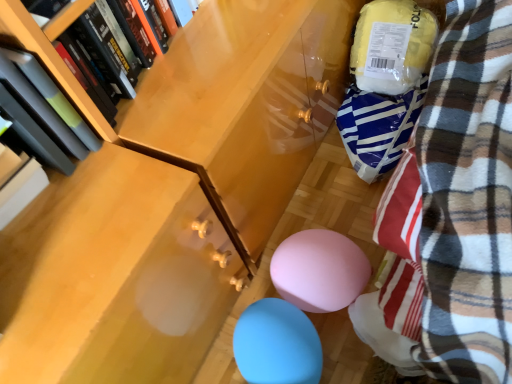
Question: From a real-world perspective, is blue rubber balloon at lower center on top of hardcover book at upper left, which appears as the 2th book when viewed from the left?

Choices:
 (A) no
 (B) yes

Answer: (A)

Question: Is hardcover book at upper left, the first book when ordered from right to left, inside blue rubber balloon at lower center?

Choices:
 (A) no
 (B) yes

Answer: (A)

Question: From the image's perspective, does blue rubber balloon at lower center appear lower than hardcover book at upper left, which appears as the 2th book when viewed from the left?

Choices:
 (A) yes
 (B) no

Answer: (A)

Question: Is blue rubber balloon at lower center to the right of hardcover book at upper left, which appears as the 2th book when viewed from the left, from the viewer's perspective?

Choices:
 (A) no
 (B) yes

Answer: (B)

Question: Is blue rubber balloon at lower center facing away from hardcover book at upper left, the first book when ordered from right to left?

Choices:
 (A) yes
 (B) no

Answer: (B)

Question: Is the depth of blue rubber balloon at lower center greater than that of hardcover book at upper left, the first book when ordered from right to left?

Choices:
 (A) yes
 (B) no

Answer: (A)

Question: Is matte black book at left, arranged as the first book when viewed from the left, bigger than hardcover book at upper left, the first book when ordered from right to left?

Choices:
 (A) yes
 (B) no

Answer: (A)

Question: From a real-world perspective, is matte black book at left, the 2th book viewed from the right, under hardcover book at upper left, the first book when ordered from right to left?

Choices:
 (A) no
 (B) yes

Answer: (A)

Question: Is matte black book at left, arranged as the first book when viewed from the left, directly adjacent to hardcover book at upper left, the first book when ordered from right to left?

Choices:
 (A) no
 (B) yes

Answer: (A)

Question: Is matte black book at left, the 2th book viewed from the right, positioned before hardcover book at upper left, which appears as the 2th book when viewed from the left?

Choices:
 (A) no
 (B) yes

Answer: (B)

Question: From the image's perspective, would you say matte black book at left, arranged as the first book when viewed from the left, is positioned over hardcover book at upper left, which appears as the 2th book when viewed from the left?

Choices:
 (A) yes
 (B) no

Answer: (B)

Question: Is matte black book at left, arranged as the first book when viewed from the left, aimed at hardcover book at upper left, which appears as the 2th book when viewed from the left?

Choices:
 (A) no
 (B) yes

Answer: (A)

Question: Does hardcover book at upper left, which appears as the 2th book when viewed from the left, lie behind blue rubber balloon at lower center?

Choices:
 (A) yes
 (B) no

Answer: (B)